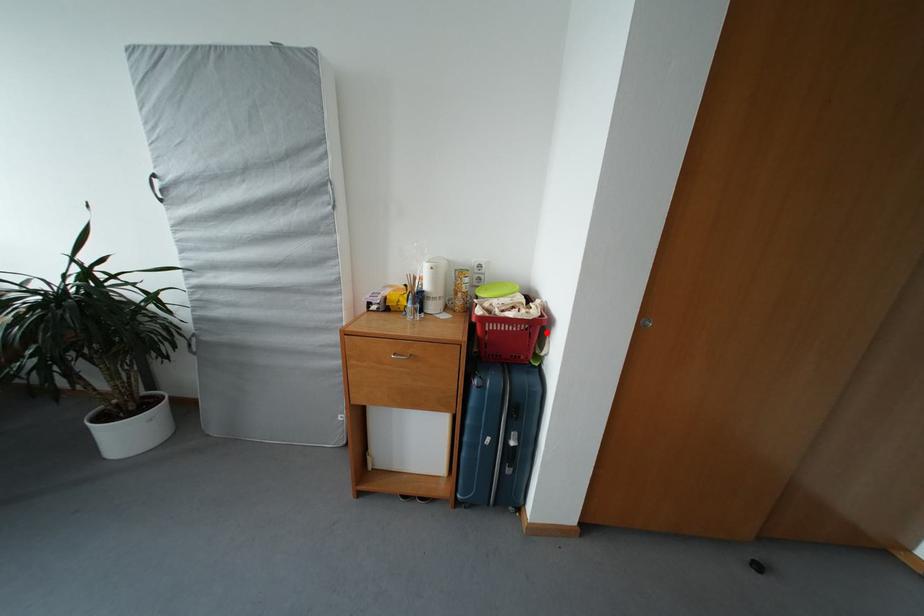
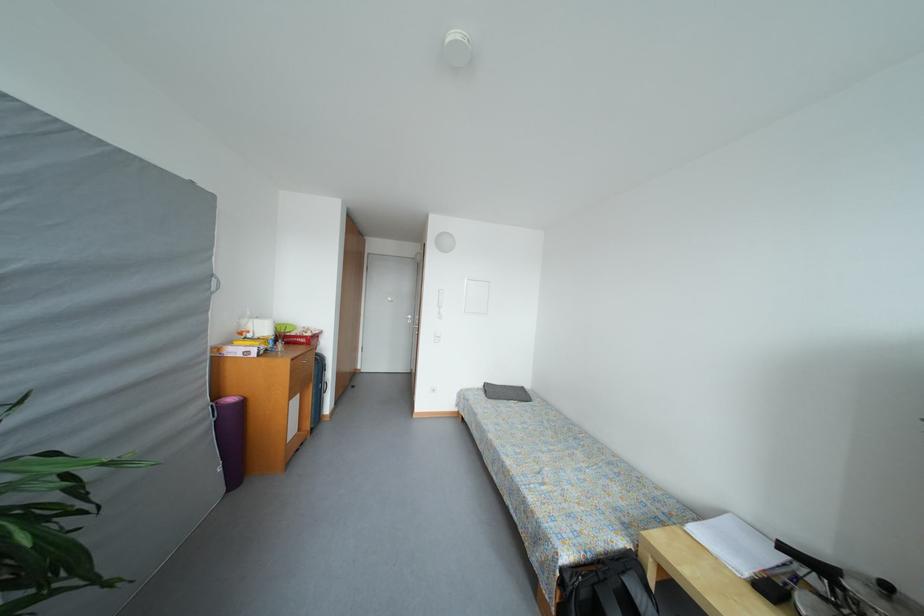
Question: I am providing you with two images of the same scene from different viewpoints. A red point is marked on the first image. At the location where the point appears in image 1, is it still visible in image 2?

Choices:
 (A) Yes
 (B) No

Answer: (B)